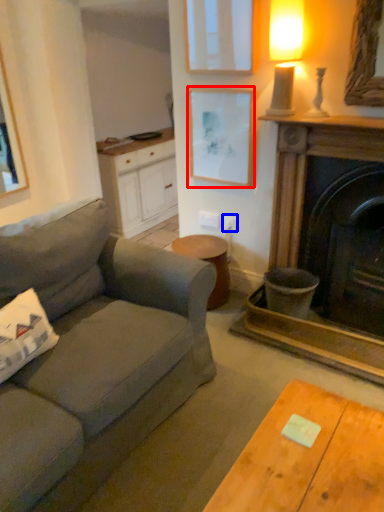
Question: Among these objects, which one is farthest to the camera, picture frame (highlighted by a red box) or power outlet (highlighted by a blue box)?

Choices:
 (A) picture frame
 (B) power outlet

Answer: (B)